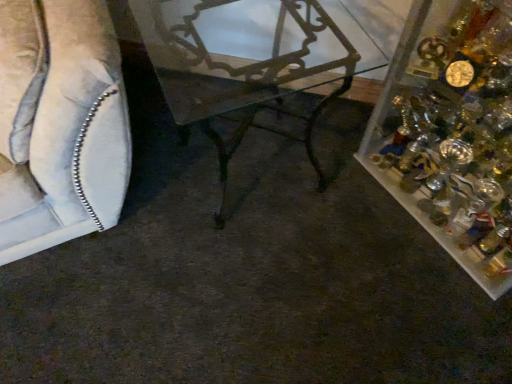
Question: Considering the relative sizes of metallic wrought iron table at center and clear plastic container at right in the image provided, is metallic wrought iron table at center shorter than clear plastic container at right?

Choices:
 (A) yes
 (B) no

Answer: (A)

Question: From the image's perspective, is metallic wrought iron table at center on top of clear plastic container at right?

Choices:
 (A) yes
 (B) no

Answer: (A)

Question: Considering the relative sizes of metallic wrought iron table at center and clear plastic container at right in the image provided, is metallic wrought iron table at center taller than clear plastic container at right?

Choices:
 (A) no
 (B) yes

Answer: (A)

Question: From the image's perspective, is metallic wrought iron table at center located beneath clear plastic container at right?

Choices:
 (A) no
 (B) yes

Answer: (A)

Question: Can you confirm if metallic wrought iron table at center is positioned to the left of clear plastic container at right?

Choices:
 (A) no
 (B) yes

Answer: (B)

Question: Can you confirm if metallic wrought iron table at center is thinner than clear plastic container at right?

Choices:
 (A) no
 (B) yes

Answer: (B)

Question: Does clear plastic container at right have a lesser width compared to metallic wrought iron table at center?

Choices:
 (A) no
 (B) yes

Answer: (A)

Question: From a real-world perspective, is clear plastic container at right on metallic wrought iron table at center?

Choices:
 (A) yes
 (B) no

Answer: (A)

Question: Is clear plastic container at right closer to the viewer compared to metallic wrought iron table at center?

Choices:
 (A) no
 (B) yes

Answer: (B)

Question: Is metallic wrought iron table at center inside clear plastic container at right?

Choices:
 (A) yes
 (B) no

Answer: (B)

Question: Can you confirm if clear plastic container at right is bigger than metallic wrought iron table at center?

Choices:
 (A) yes
 (B) no

Answer: (A)

Question: Does clear plastic container at right have a greater height compared to metallic wrought iron table at center?

Choices:
 (A) no
 (B) yes

Answer: (B)

Question: Can you confirm if metallic wrought iron table at center is smaller than suede-like beige sofa at left?

Choices:
 (A) no
 (B) yes

Answer: (B)